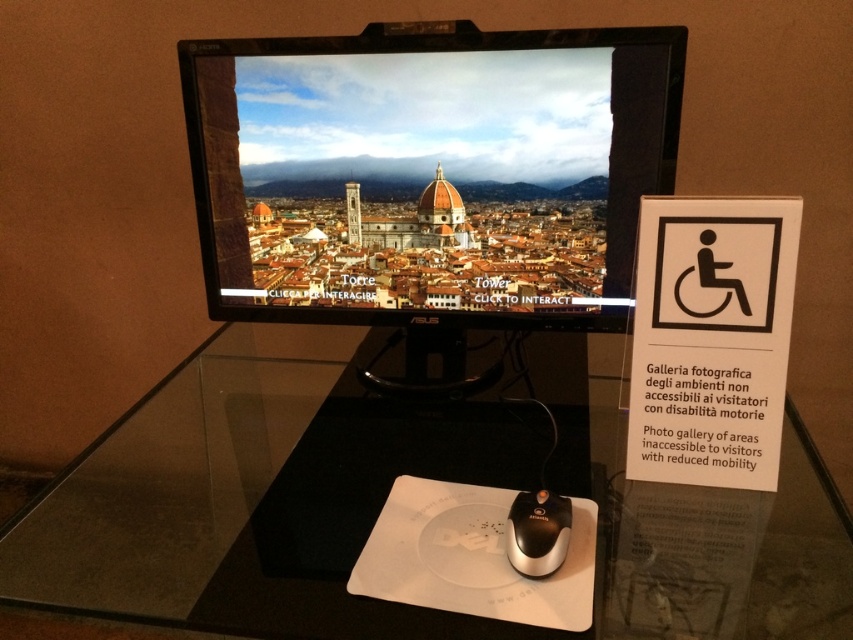
You are using a black plastic mouse at lower center to interact with the computer monitor. There is a white paper at right nearby. If you want to place the mouse on the white paper, will it fit?

The white paper at right is larger in size than the black plastic mouse at lower center, so yes, the mouse will fit on the white paper.

What is the height relationship between the white paper at right and the black plastic mouse at lower center?

The white paper at right is much taller than the black plastic mouse at lower center.

Looking at this image, you are using the black plastic mouse at lower center to click on the white paper at right. Can you reach it with a single click without moving the mouse?

The distance between the black plastic mouse at lower center and the white paper at right is 11.62 inches. Since the mouse can move freely on the desk, you can move it to reach the white paper at right with a single click.